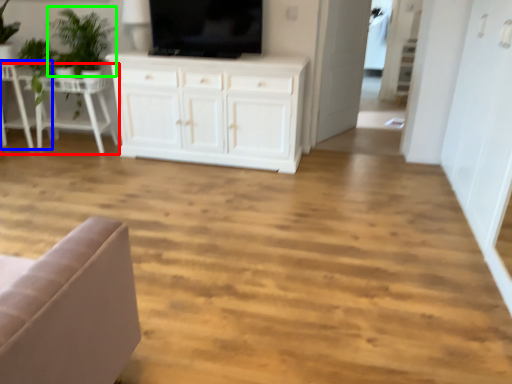
Question: Which object is the closest to the table (highlighted by a red box)? Choose among these: chair (highlighted by a blue box) or plant (highlighted by a green box).

Choices:
 (A) chair
 (B) plant

Answer: (A)